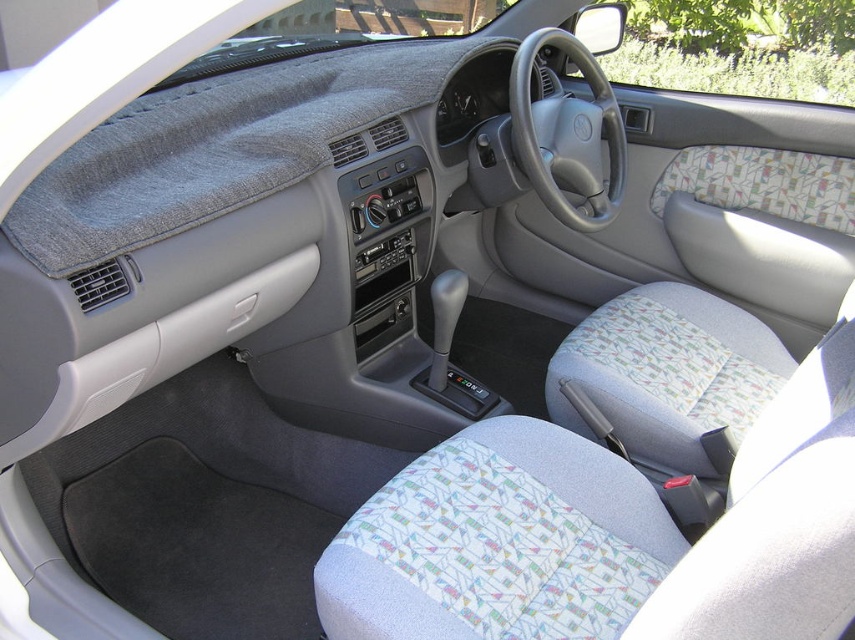
Does point (780, 589) come farther from viewer compared to point (234, 161)?

No, it is in front of (234, 161).

Is the position of textured fabric seat at center less distant than that of gray fabric dashboard cover at upper center?

Yes.

This screenshot has width=855, height=640. Describe the element at coordinates (609, 532) in the screenshot. I see `textured fabric seat at center` at that location.

The width and height of the screenshot is (855, 640). Find the location of `textured fabric seat at center`. textured fabric seat at center is located at coordinates (609, 532).